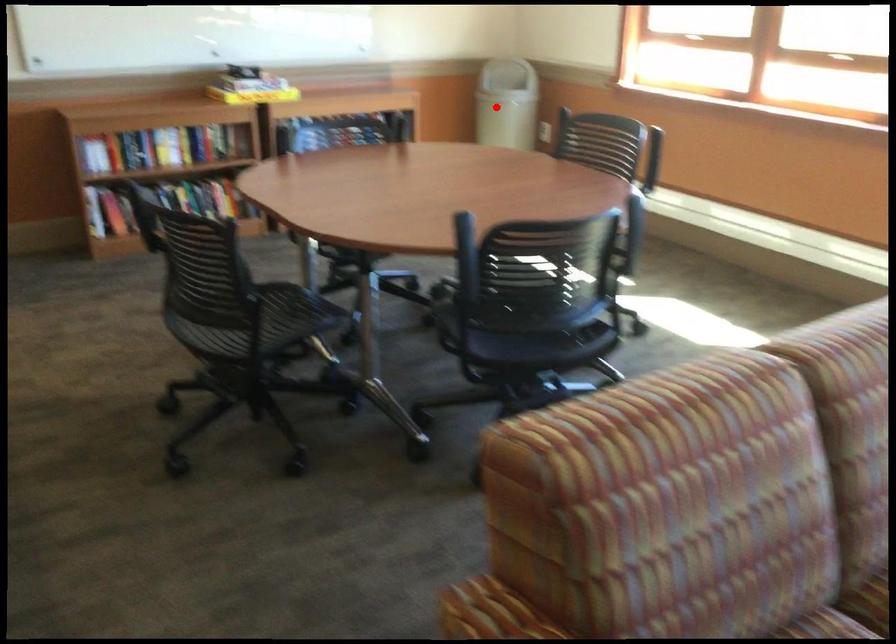
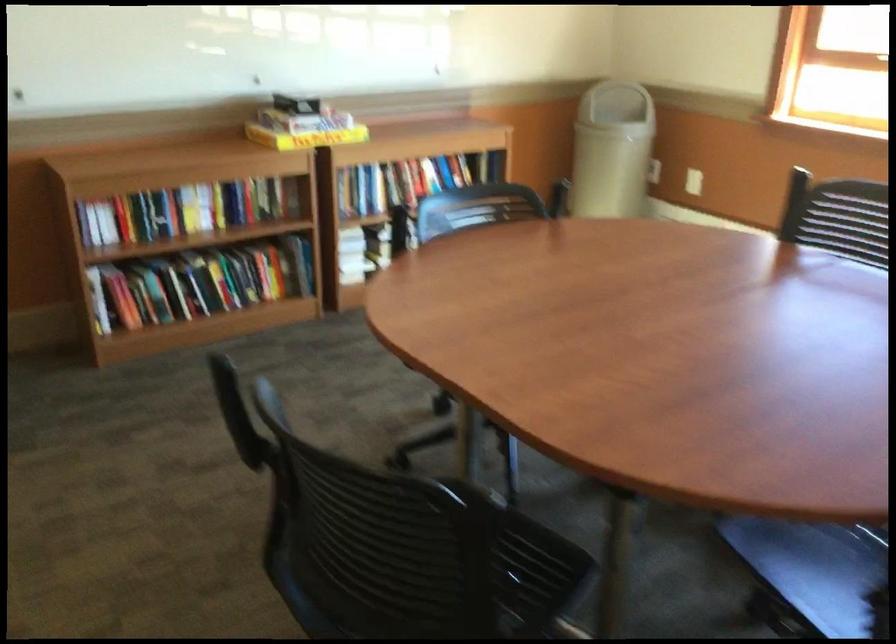
Locate, in the second image, the point that corresponds to the highlighted location in the first image.

(612, 149)